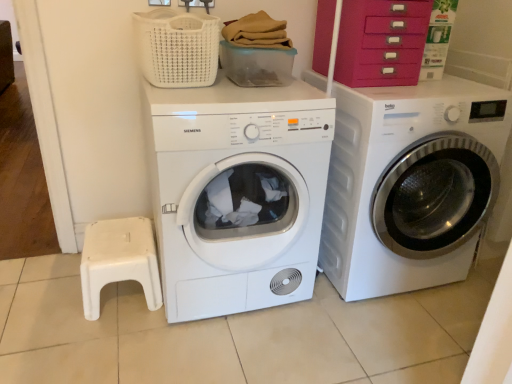
Where is `vacant space situated on the left part of white plastic step stool at lower left`? vacant space situated on the left part of white plastic step stool at lower left is located at coordinates (39, 302).